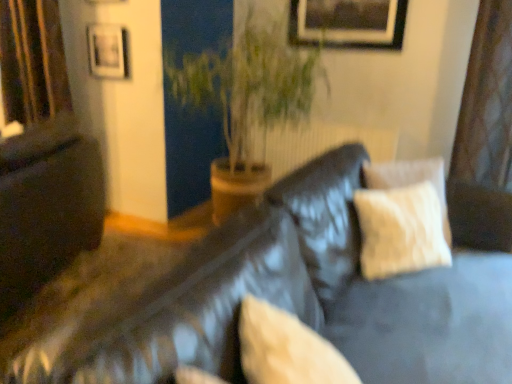
Question: Is green leafy plant at center in front of matte black couch at left?

Choices:
 (A) yes
 (B) no

Answer: (B)

Question: Is green leafy plant at center taller than matte black couch at left?

Choices:
 (A) no
 (B) yes

Answer: (B)

Question: Is green leafy plant at center at the right side of matte black couch at left?

Choices:
 (A) yes
 (B) no

Answer: (A)

Question: Considering the relative sizes of green leafy plant at center and matte black couch at left in the image provided, is green leafy plant at center smaller than matte black couch at left?

Choices:
 (A) yes
 (B) no

Answer: (B)

Question: Is green leafy plant at center oriented away from matte black couch at left?

Choices:
 (A) no
 (B) yes

Answer: (A)

Question: From the image's perspective, is matte black picture frame at upper left, which is the first picture frame in left-to-right order, above or below beige fabric pillow at center?

Choices:
 (A) above
 (B) below

Answer: (A)

Question: Is matte black picture frame at upper left, arranged as the 2th picture frame when viewed from the right, taller or shorter than beige fabric pillow at center?

Choices:
 (A) tall
 (B) short

Answer: (A)

Question: Is matte black picture frame at upper left, arranged as the 2th picture frame when viewed from the right, bigger or smaller than beige fabric pillow at center?

Choices:
 (A) big
 (B) small

Answer: (B)

Question: Does point (123, 41) appear closer or farther from the camera than point (262, 307)?

Choices:
 (A) farther
 (B) closer

Answer: (A)

Question: Based on their positions, is beige fabric pillow at center located to the left or right of matte black picture frame at upper left, which is the first picture frame in left-to-right order?

Choices:
 (A) right
 (B) left

Answer: (A)

Question: Is beige fabric pillow at center situated inside matte black picture frame at upper left, arranged as the 2th picture frame when viewed from the right, or outside?

Choices:
 (A) inside
 (B) outside

Answer: (B)

Question: Considering the positions of beige fabric pillow at center and matte black picture frame at upper left, which is the first picture frame in left-to-right order, in the image, is beige fabric pillow at center taller or shorter than matte black picture frame at upper left, which is the first picture frame in left-to-right order,?

Choices:
 (A) short
 (B) tall

Answer: (A)

Question: From the image's perspective, relative to matte black picture frame at upper left, which is the first picture frame in left-to-right order, is beige fabric pillow at center above or below?

Choices:
 (A) below
 (B) above

Answer: (A)

Question: Is silky brown curtain at left wider or thinner than beige fabric pillow at center?

Choices:
 (A) wide
 (B) thin

Answer: (A)

Question: Do you think silky brown curtain at left is within beige fabric pillow at center, or outside of it?

Choices:
 (A) outside
 (B) inside

Answer: (A)